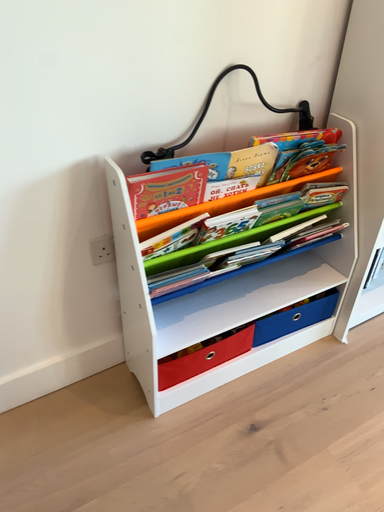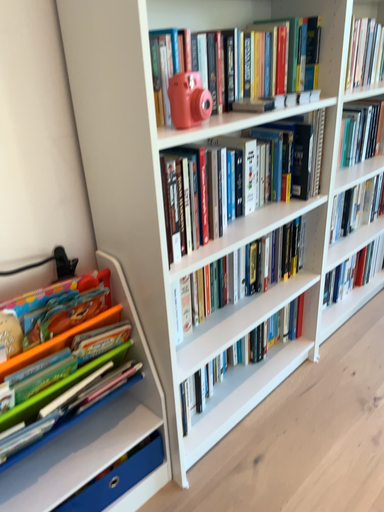
Question: Which way did the camera rotate in the video?

Choices:
 (A) rotated right
 (B) rotated left

Answer: (A)